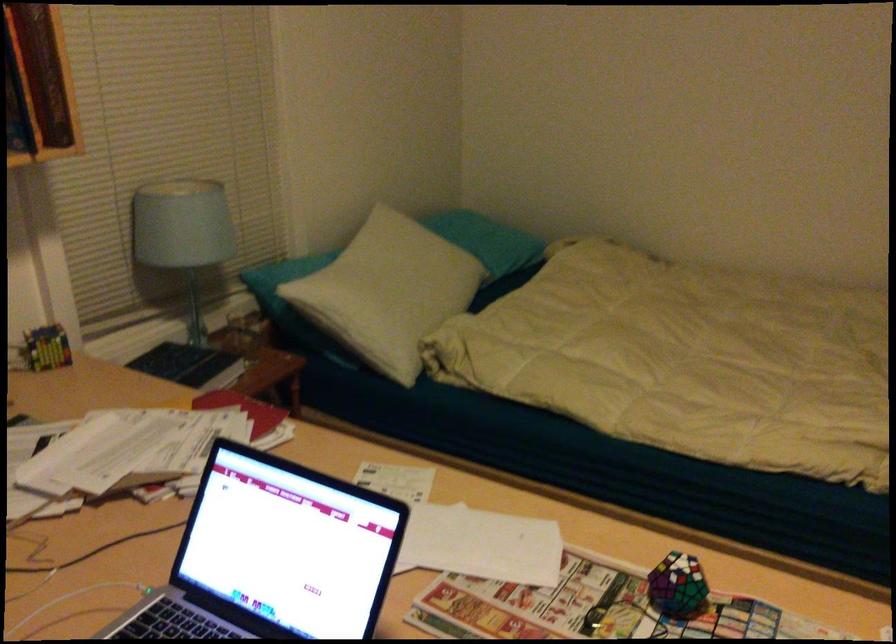
Find the location of a particular element. This screenshot has width=896, height=644. blue pillow is located at coordinates (391, 285).